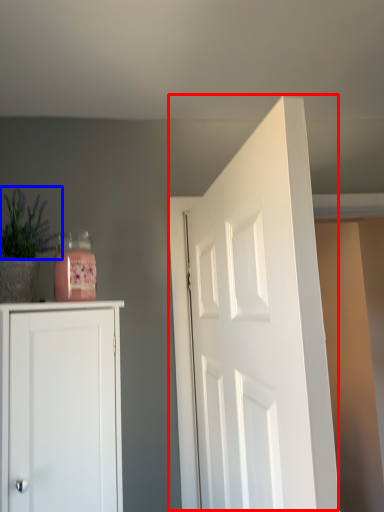
Question: Which of the following is the farthest to the observer, door (highlighted by a red box) or plant (highlighted by a blue box)?

Choices:
 (A) door
 (B) plant

Answer: (B)